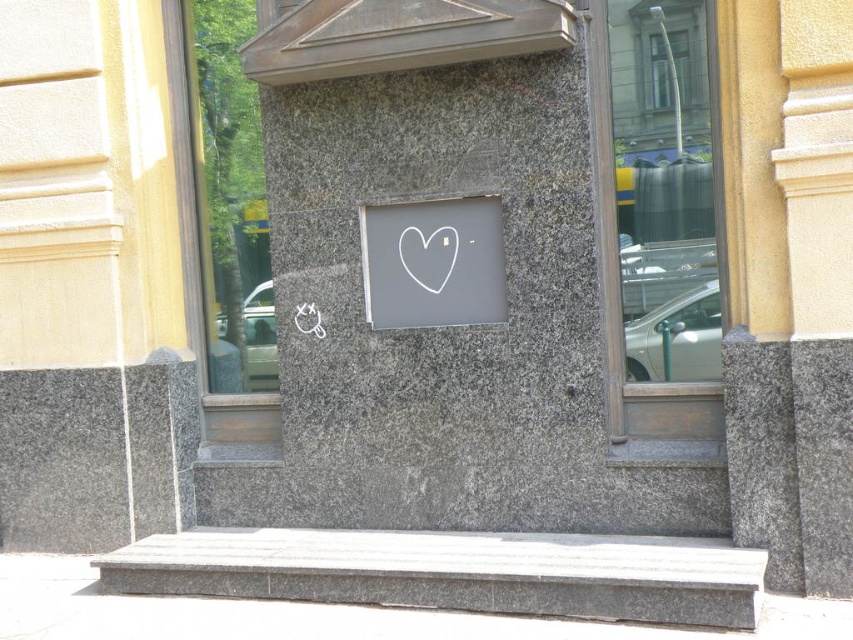
Is white chalk heart at center smaller than white matte heart at center?

No, white chalk heart at center is not smaller than white matte heart at center.

Which of these two, white chalk heart at center or white matte heart at center, stands shorter?

white matte heart at center

Where is `white chalk heart at center`? The width and height of the screenshot is (853, 640). white chalk heart at center is located at coordinates (433, 262).